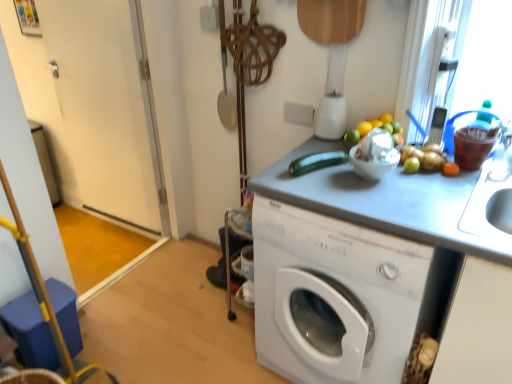
Question: Is white plastic blender at upper center taller or shorter than white glossy washing machine at center?

Choices:
 (A) tall
 (B) short

Answer: (B)

Question: Based on their positions, is white plastic blender at upper center located to the left or right of white glossy washing machine at center?

Choices:
 (A) left
 (B) right

Answer: (A)

Question: Which object is the farthest from the white plastic blender at upper center?

Choices:
 (A) green matte zucchini at center
 (B) white glossy bowl at center
 (C) white glossy washing machine at center
 (D) white glossy door at left

Answer: (D)

Question: Which object is the farthest from the green matte zucchini at center?

Choices:
 (A) white glossy door at left
 (B) white plastic blender at upper center
 (C) white glossy bowl at center
 (D) white glossy washing machine at center

Answer: (A)